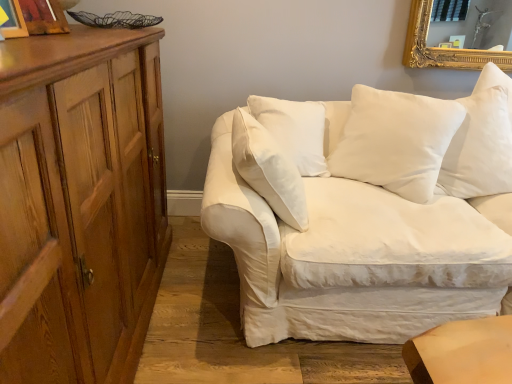
What is the approximate width of wooden picture frame at upper left, the 1th picture frame when ordered from back to front?

4.87 inches.

Describe the element at coordinates (369, 216) in the screenshot. I see `white cotton couch at center` at that location.

Measure the distance between point (5, 31) and camera.

Point (5, 31) is 3.69 feet away from camera.

Locate an element on the screen. wooden picture frame at upper left, acting as the second picture frame starting from the back is located at coordinates (13, 20).

Locate an element on the screen. The width and height of the screenshot is (512, 384). white cotton pillow at center, the 2th pillow from the right is located at coordinates (394, 141).

What do you see at coordinates (79, 203) in the screenshot? I see `wooden cabinet at left` at bounding box center [79, 203].

Find the location of `white soft pillow at upper right, the 2th pillow in the left-to-right sequence`. white soft pillow at upper right, the 2th pillow in the left-to-right sequence is located at coordinates (480, 148).

Find the location of a particular element. wooden picture frame at upper left, which is the second picture frame from front to back is located at coordinates (44, 17).

From the image's perspective, which is below, wooden picture frame at upper left, the 1th picture frame in the front-to-back sequence, or white soft pillow at upper right, arranged as the first pillow when viewed from the right?

white soft pillow at upper right, arranged as the first pillow when viewed from the right.

Which is in front, wooden picture frame at upper left, acting as the second picture frame starting from the back, or white soft pillow at upper right, the 2th pillow in the left-to-right sequence?

wooden picture frame at upper left, acting as the second picture frame starting from the back, is more forward.

You are a GUI agent. You are given a task and a screenshot of the screen. Output one action in this format:
    pyautogui.click(x=<x>, y=<y>)
    Task: Click on the 1st pillow below the wooden picture frame at upper left, the 1th picture frame in the front-to-back sequence (from the image's perspective)
    
    Given the screenshot: What is the action you would take?
    pyautogui.click(x=480, y=148)

Who is smaller, wooden picture frame at upper left, acting as the second picture frame starting from the back, or white soft pillow at upper right, arranged as the first pillow when viewed from the right?

With smaller size is wooden picture frame at upper left, acting as the second picture frame starting from the back.

From a real-world perspective, between white soft pillow at upper right, the 2th pillow in the left-to-right sequence, and wooden cabinet at left, who is vertically higher?

In real-world perspective, white soft pillow at upper right, the 2th pillow in the left-to-right sequence, is above.

Which object is closer to the camera taking this photo, white soft pillow at upper right, the 2th pillow in the left-to-right sequence, or wooden cabinet at left?

wooden cabinet at left is more forward.

Can we say white soft pillow at upper right, the 2th pillow in the left-to-right sequence, lies outside wooden cabinet at left?

white soft pillow at upper right, the 2th pillow in the left-to-right sequence, is positioned outside wooden cabinet at left.

In terms of size, does white soft pillow at upper right, the 2th pillow in the left-to-right sequence, appear bigger or smaller than wooden cabinet at left?

In the image, white soft pillow at upper right, the 2th pillow in the left-to-right sequence, appears to be smaller than wooden cabinet at left.

From a real-world perspective, is wooden picture frame at upper left, which is the second picture frame from front to back, physically below white soft pillow at upper right, arranged as the first pillow when viewed from the right?

Incorrect, from a real-world perspective, wooden picture frame at upper left, which is the second picture frame from front to back, is higher than white soft pillow at upper right, arranged as the first pillow when viewed from the right.

Is wooden picture frame at upper left, which is the second picture frame from front to back, wider or thinner than white soft pillow at upper right, arranged as the first pillow when viewed from the right?

Considering their sizes, wooden picture frame at upper left, which is the second picture frame from front to back, looks slimmer than white soft pillow at upper right, arranged as the first pillow when viewed from the right.

Is wooden picture frame at upper left, the 1th picture frame when ordered from back to front, next to white soft pillow at upper right, the 2th pillow in the left-to-right sequence, and touching it?

No, wooden picture frame at upper left, the 1th picture frame when ordered from back to front, is not in contact with white soft pillow at upper right, the 2th pillow in the left-to-right sequence.

Measure the distance between wooden picture frame at upper left, acting as the second picture frame starting from the back, and wooden cabinet at left.

The distance of wooden picture frame at upper left, acting as the second picture frame starting from the back, from wooden cabinet at left is 51.79 centimeters.

Looking at this image, can you tell me how much wooden picture frame at upper left, acting as the second picture frame starting from the back, and wooden cabinet at left differ in facing direction?

10.6 degrees.

Does wooden picture frame at upper left, acting as the second picture frame starting from the back, have a greater height compared to wooden cabinet at left?

No, wooden picture frame at upper left, acting as the second picture frame starting from the back, is not taller than wooden cabinet at left.

Is point (11, 22) in front of point (81, 215)?

No, (11, 22) is behind (81, 215).

Visually, is wooden cabinet at left positioned to the left or to the right of white cotton couch at center?

wooden cabinet at left is positioned on white cotton couch at center's left side.

Considering the sizes of objects wooden cabinet at left and white cotton couch at center in the image provided, who is bigger, wooden cabinet at left or white cotton couch at center?

white cotton couch at center is bigger.

Considering the relative sizes of wooden cabinet at left and white cotton couch at center in the image provided, is wooden cabinet at left thinner than white cotton couch at center?

Indeed, wooden cabinet at left has a lesser width compared to white cotton couch at center.

From a real-world perspective, is white cotton couch at center physically above white soft pillow at upper right, the 2th pillow in the left-to-right sequence?

No, from a real-world perspective, white cotton couch at center is not above white soft pillow at upper right, the 2th pillow in the left-to-right sequence.

Between white cotton couch at center and white soft pillow at upper right, arranged as the first pillow when viewed from the right, which one has more height?

With more height is white cotton couch at center.

From the image's perspective, which is below, white cotton couch at center or white soft pillow at upper right, arranged as the first pillow when viewed from the right?

white cotton couch at center appears lower in the image.

Is wooden picture frame at upper left, the 1th picture frame in the front-to-back sequence, facing towards white cotton couch at center?

No, wooden picture frame at upper left, the 1th picture frame in the front-to-back sequence, does not turn towards white cotton couch at center.

Is wooden picture frame at upper left, acting as the second picture frame starting from the back, behind white cotton couch at center?

No, it is in front of white cotton couch at center.

In the scene shown: Is wooden picture frame at upper left, acting as the second picture frame starting from the back, touching white cotton couch at center?

No, wooden picture frame at upper left, acting as the second picture frame starting from the back, is not making contact with white cotton couch at center.

From a real-world perspective, is wooden picture frame at upper left, acting as the second picture frame starting from the back, positioned above or below white cotton couch at center?

In terms of real-world spatial position, wooden picture frame at upper left, acting as the second picture frame starting from the back, is above white cotton couch at center.

Find the location of a particular element. Image resolution: width=512 pixels, height=384 pixels. picture frame that is the 2nd one above the white soft pillow at upper right, arranged as the first pillow when viewed from the right (from a real-world perspective) is located at coordinates (13, 20).

Where is `cabinetry below the white soft pillow at upper right, arranged as the first pillow when viewed from the right (from the image's perspective)`? This screenshot has width=512, height=384. cabinetry below the white soft pillow at upper right, arranged as the first pillow when viewed from the right (from the image's perspective) is located at coordinates (79, 203).

Looking at the image, which one is located further to wooden cabinet at left, wooden picture frame at upper left, the 1th picture frame when ordered from back to front, or white cotton couch at center?

Based on the image, white cotton couch at center appears to be further to wooden cabinet at left.

Which object lies further to the anchor point wooden picture frame at upper left, the 1th picture frame when ordered from back to front, wooden cabinet at left or white soft pillow at upper right, arranged as the first pillow when viewed from the right?

white soft pillow at upper right, arranged as the first pillow when viewed from the right.

Looking at the image, which one is located closer to white cotton couch at center, wooden cabinet at left or white soft pillow at upper right, arranged as the first pillow when viewed from the right?

Among the two, white soft pillow at upper right, arranged as the first pillow when viewed from the right, is located nearer to white cotton couch at center.

Based on their spatial positions, is wooden cabinet at left or white cotton couch at center closer to white cotton pillow at center, the 2th pillow from the right?

The object closer to white cotton pillow at center, the 2th pillow from the right, is white cotton couch at center.

Looking at the image, which one is located further to white cotton couch at center, white cotton pillow at center, the 2th pillow from the right, or white soft pillow at upper right, the 2th pillow in the left-to-right sequence?

white soft pillow at upper right, the 2th pillow in the left-to-right sequence.

From the image, which object appears to be nearer to white cotton pillow at center, the 2th pillow from the right, white cotton couch at center or wooden picture frame at upper left, which is the second picture frame from front to back?

white cotton couch at center lies closer to white cotton pillow at center, the 2th pillow from the right, than the other object.

Based on their spatial positions, is white cotton couch at center or wooden picture frame at upper left, which is the second picture frame from front to back, further from wooden cabinet at left?

white cotton couch at center is positioned further to the anchor wooden cabinet at left.

Estimate the real-world distances between objects in this image. Which object is closer to white cotton couch at center, white soft pillow at upper right, the 2th pillow in the left-to-right sequence, or wooden picture frame at upper left, the 1th picture frame in the front-to-back sequence?

Among the two, white soft pillow at upper right, the 2th pillow in the left-to-right sequence, is located nearer to white cotton couch at center.

Where is `cabinetry located between wooden picture frame at upper left, which is the second picture frame from front to back, and white cotton couch at center in the left-right direction`? Image resolution: width=512 pixels, height=384 pixels. cabinetry located between wooden picture frame at upper left, which is the second picture frame from front to back, and white cotton couch at center in the left-right direction is located at coordinates [x=79, y=203].

Identify the location of pillow located between wooden picture frame at upper left, acting as the second picture frame starting from the back, and white cotton couch at center in the left-right direction. (394, 141).

The image size is (512, 384). In order to click on picture frame between wooden picture frame at upper left, which is the second picture frame from front to back, and white cotton couch at center in this screenshot , I will do `click(13, 20)`.

Image resolution: width=512 pixels, height=384 pixels. Find the location of `cabinetry between wooden picture frame at upper left, which is the second picture frame from front to back, and white cotton pillow at center, the 2th pillow from the right, from left to right`. cabinetry between wooden picture frame at upper left, which is the second picture frame from front to back, and white cotton pillow at center, the 2th pillow from the right, from left to right is located at coordinates (79, 203).